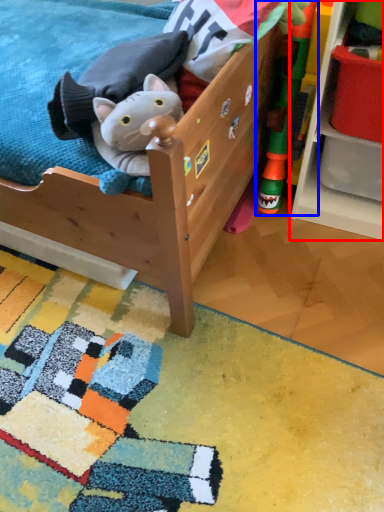
Question: Which object appears closest to the camera in this image, shelf (highlighted by a red box) or toy (highlighted by a blue box)?

Choices:
 (A) shelf
 (B) toy

Answer: (A)